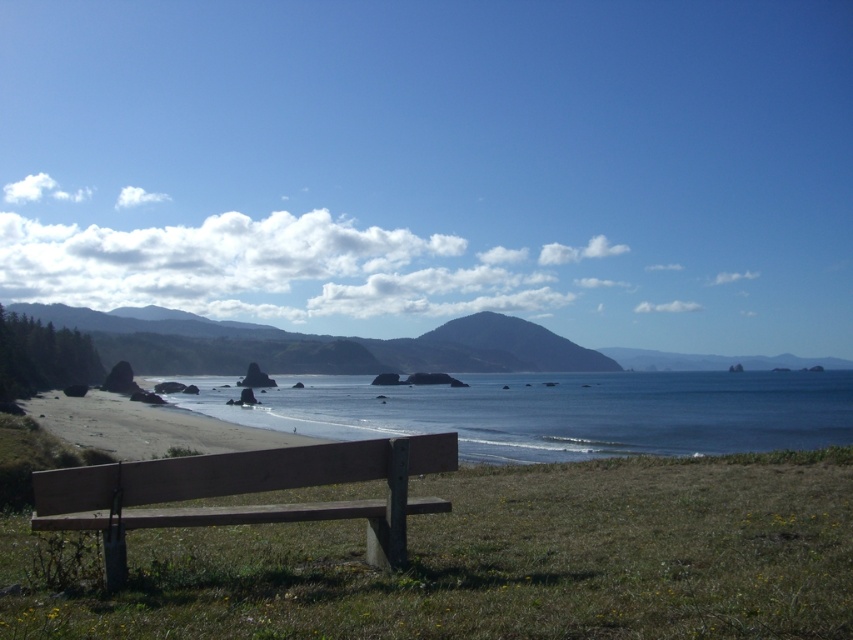
Is blue water at center closer to the viewer compared to wooden bench at lower left?

No, it is behind wooden bench at lower left.

This screenshot has height=640, width=853. Describe the element at coordinates (556, 412) in the screenshot. I see `blue water at center` at that location.

Is point (289, 417) positioned after point (349, 506)?

Yes, point (289, 417) is farther from viewer.

Where is `blue water at center`? blue water at center is located at coordinates (556, 412).

Locate an element on the screen. The width and height of the screenshot is (853, 640). green grass at lower center is located at coordinates (498, 561).

Between point (502, 516) and point (108, 557), which one is positioned behind?

Point (502, 516)

The height and width of the screenshot is (640, 853). Find the location of `green grass at lower center`. green grass at lower center is located at coordinates (498, 561).

Is point (415, 525) farther from viewer compared to point (598, 392)?

No, (415, 525) is in front of (598, 392).

The height and width of the screenshot is (640, 853). I want to click on green grass at lower center, so click(x=498, y=561).

Find the location of a particular element. green grass at lower center is located at coordinates (498, 561).